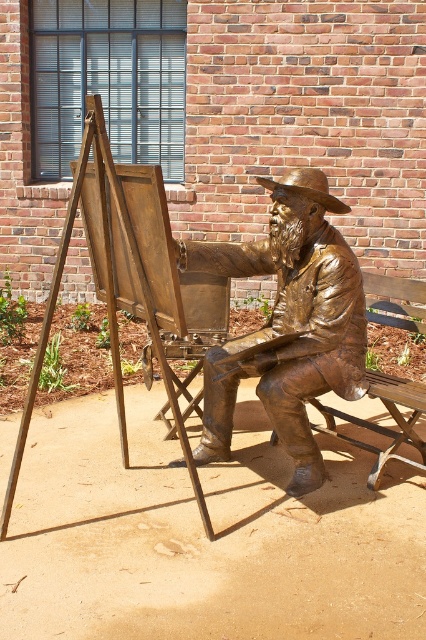
You are an art student who wants to paint a landscape. You have a limited space in your studio. The wooden easel at left and bronze textured cowboy hat at center are in your way. Which object should you move to free up more vertical space?

The wooden easel at left is much taller than the bronze textured cowboy hat at center, so you should move the wooden easel at left to free up more vertical space.

You are an art student who wants to sketch the bronze statue at center and the bronze textured cowboy hat at center. From your perspective, which object is located to the right?

The bronze textured cowboy hat at center is located to the right of the bronze statue at center.

You are standing in front of the bronze statue of the seated man. You notice two points on the statue, one at coordinate point [60,248] and the other at point [331,209]. Which point is closer to your eyes?

Point [60,248] is closer to the camera than point [331,209], so the point at coordinate [60,248] is closer to your eyes.